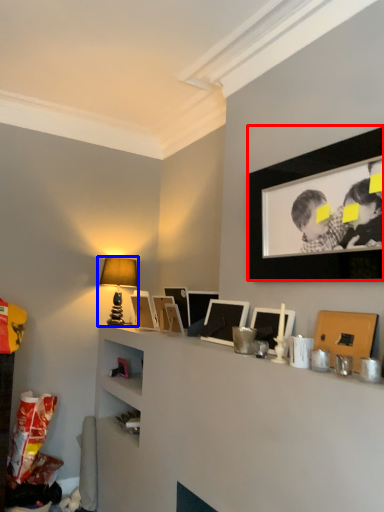
Question: Which object appears closest to the camera in this image, picture frame (highlighted by a red box) or table lamp (highlighted by a blue box)?

Choices:
 (A) picture frame
 (B) table lamp

Answer: (A)